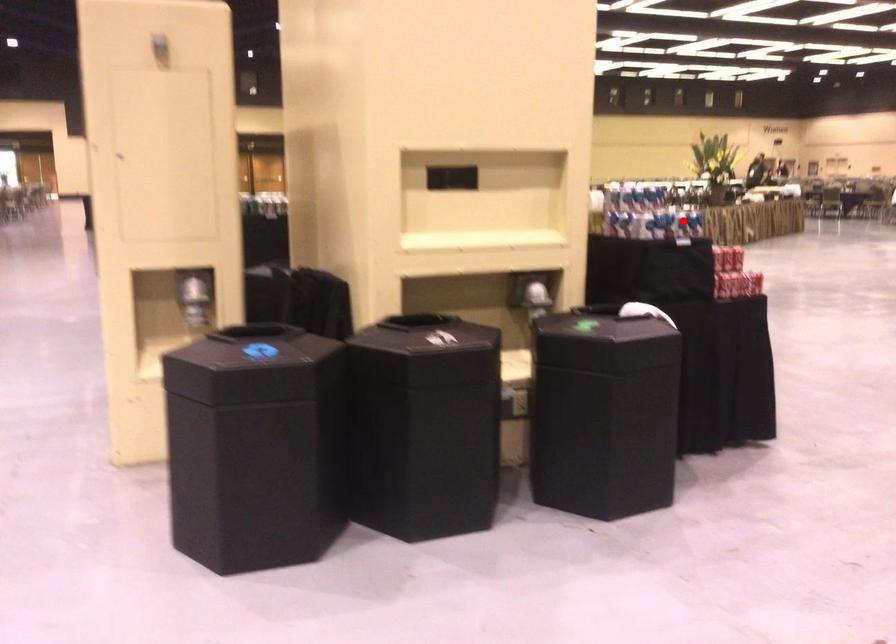
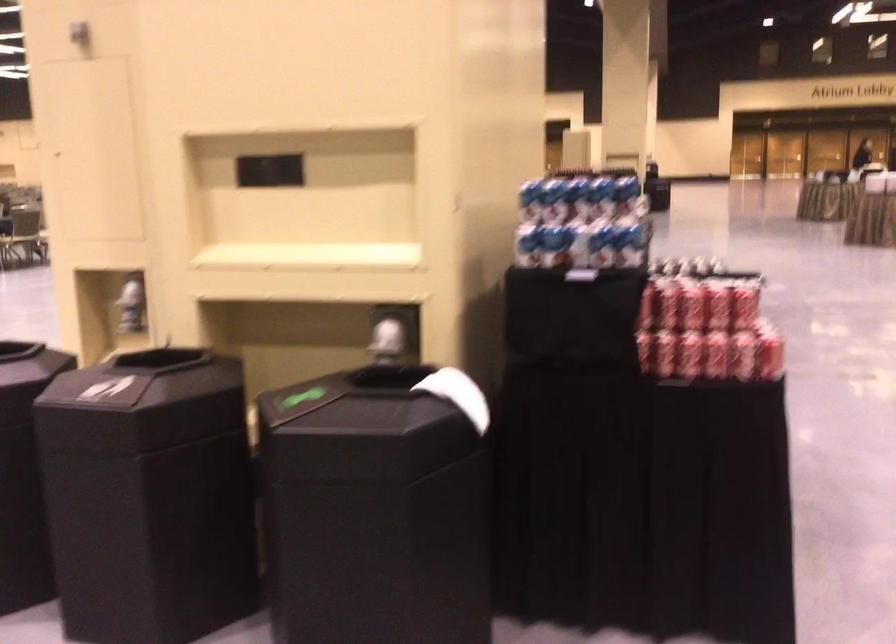
Question: I am providing you with two images of the same scene from different viewpoints. A red point is shown in image1. For the corresponding object point in image2, is it positioned nearer or farther from the camera?

Choices:
 (A) Nearer
 (B) Farther

Answer: (A)